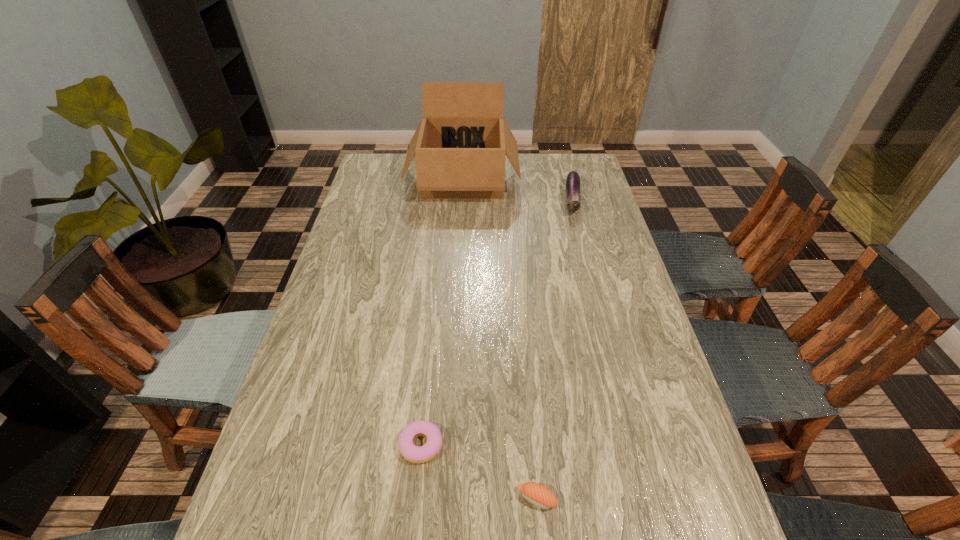
In order to click on box in this screenshot , I will do `click(460, 144)`.

Locate an element on the screen. This screenshot has width=960, height=540. eggplant is located at coordinates (572, 186).

Locate an element on the screen. Image resolution: width=960 pixels, height=540 pixels. the third shortest object is located at coordinates (572, 186).

Locate an element on the screen. Image resolution: width=960 pixels, height=540 pixels. the nearest object is located at coordinates (537, 494).

Locate an element on the screen. The height and width of the screenshot is (540, 960). the third tallest object is located at coordinates (537, 494).

At what (x,y) coordinates should I click in order to perform the action: click on doughnut. Please return your answer as a coordinate pair (x, y). Looking at the image, I should click on (412, 453).

Find the location of a particular element. The height and width of the screenshot is (540, 960). the shortest object is located at coordinates tap(412, 453).

Where is `vacant area situated 0.250m on the front of the tallest object`? vacant area situated 0.250m on the front of the tallest object is located at coordinates (459, 254).

Locate an element on the screen. This screenshot has height=540, width=960. vacant space located 0.160m on the back of the second tallest object is located at coordinates (562, 160).

The height and width of the screenshot is (540, 960). Identify the location of vacant space located 0.130m on the left of the sushi. (451, 499).